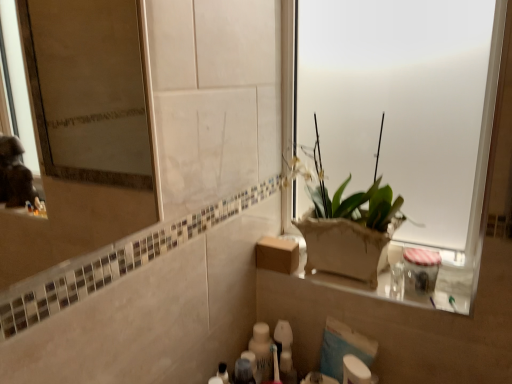
Question: Does brown cardboard box at center have a lesser width compared to translucent plastic toothbrush at lower center, marked as the second toiletry in a right-to-left arrangement?

Choices:
 (A) no
 (B) yes

Answer: (A)

Question: Does brown cardboard box at center come behind translucent plastic toothbrush at lower center, marked as the second toiletry in a right-to-left arrangement?

Choices:
 (A) yes
 (B) no

Answer: (A)

Question: Does brown cardboard box at center have a greater height compared to translucent plastic toothbrush at lower center, the 3th toiletry from the left?

Choices:
 (A) yes
 (B) no

Answer: (B)

Question: Can we say brown cardboard box at center lies outside translucent plastic toothbrush at lower center, the 3th toiletry from the left?

Choices:
 (A) yes
 (B) no

Answer: (A)

Question: Is translucent plastic toothbrush at lower center, the 3th toiletry from the left, a part of brown cardboard box at center?

Choices:
 (A) no
 (B) yes

Answer: (A)

Question: Is brown cardboard box at center facing towards translucent plastic toothbrush at lower center, marked as the second toiletry in a right-to-left arrangement?

Choices:
 (A) no
 (B) yes

Answer: (A)

Question: Does white glossy bottle at lower center, which is the 2th toiletry in left-to-right order, have a greater width compared to brown cardboard box at center?

Choices:
 (A) no
 (B) yes

Answer: (A)

Question: Can you confirm if white glossy bottle at lower center, which ranks as the 3th toiletry in right-to-left order, is smaller than brown cardboard box at center?

Choices:
 (A) no
 (B) yes

Answer: (B)

Question: Would you consider white glossy bottle at lower center, which is the 2th toiletry in left-to-right order, to be distant from brown cardboard box at center?

Choices:
 (A) yes
 (B) no

Answer: (B)

Question: Does white glossy bottle at lower center, which is the 2th toiletry in left-to-right order, have a lesser height compared to brown cardboard box at center?

Choices:
 (A) no
 (B) yes

Answer: (A)

Question: Is white glossy bottle at lower center, which ranks as the 3th toiletry in right-to-left order, with brown cardboard box at center?

Choices:
 (A) no
 (B) yes

Answer: (A)

Question: Can you confirm if white glossy bottle at lower center, which ranks as the 3th toiletry in right-to-left order, is taller than brown cardboard box at center?

Choices:
 (A) yes
 (B) no

Answer: (A)

Question: Is white glossy bottle at lower center, which is the 2th toiletry in left-to-right order, shorter than white frosted glass at upper right?

Choices:
 (A) yes
 (B) no

Answer: (A)